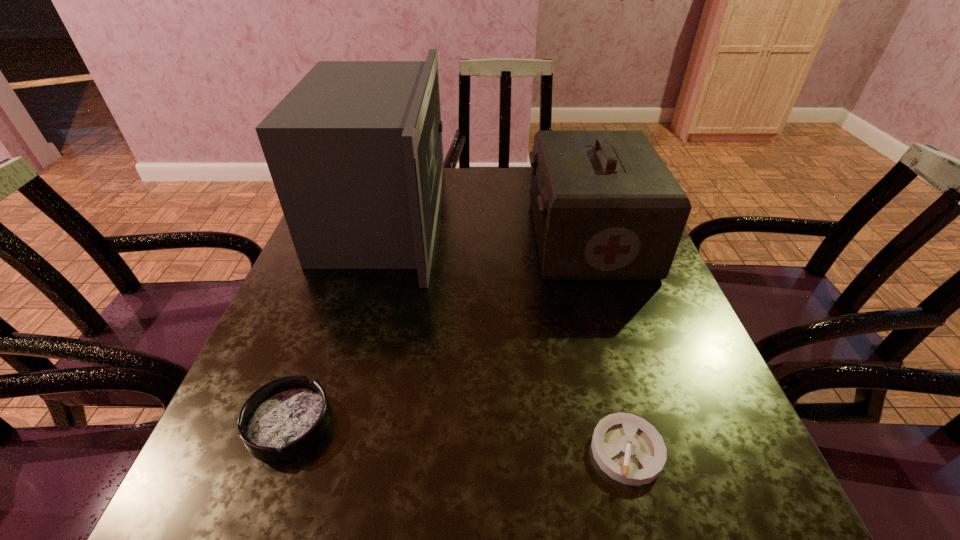
Identify the location of free point between the second shortest object and the tallest object. (336, 320).

Image resolution: width=960 pixels, height=540 pixels. What are the coordinates of `free spot between the first-aid kit and the third tallest object` in the screenshot? It's located at (439, 330).

Locate an element on the screen. The image size is (960, 540). vacant area that lies between the microwave oven and the right ashtray is located at coordinates (505, 334).

This screenshot has height=540, width=960. I want to click on free space between the first-aid kit and the tallest object, so click(486, 228).

The width and height of the screenshot is (960, 540). I want to click on free space between the shorter ashtray and the taller ashtray, so click(458, 437).

Point out which object is positioned as the second nearest to the first-aid kit. Please provide its 2D coordinates. Your answer should be formatted as a tuple, i.e. [(x, y)], where the tuple contains the x and y coordinates of a point satisfying the conditions above.

[(630, 450)]

This screenshot has width=960, height=540. I want to click on object that can be found as the closest to the shortest object, so click(x=605, y=206).

Identify the location of blank area in the image that satisfies the following two spatial constraints: 1. on the front-facing side of the second tallest object; 2. on the right side of the microwave oven. Image resolution: width=960 pixels, height=540 pixels. (377, 238).

Find the location of a particular element. This screenshot has height=540, width=960. free space that satisfies the following two spatial constraints: 1. on the front-facing side of the microwave oven; 2. on the left side of the second tallest object is located at coordinates (377, 238).

The image size is (960, 540). I want to click on free spot that satisfies the following two spatial constraints: 1. on the front-facing side of the tallest object; 2. on the back side of the first-aid kit, so tap(377, 238).